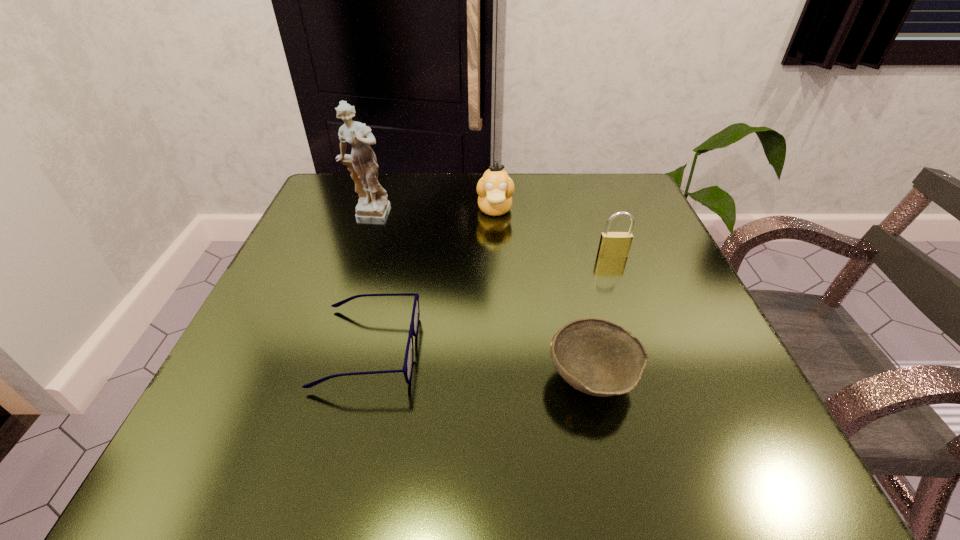
In order to click on free space between the third shortest object and the spectacles in this screenshot , I will do `click(491, 301)`.

What are the coordinates of `free area in between the fourth tallest object and the spectacles` in the screenshot? It's located at (480, 363).

In order to click on blank region between the figurine and the spectacles in this screenshot , I will do `click(368, 283)`.

Image resolution: width=960 pixels, height=540 pixels. I want to click on free point between the third tallest object and the third object from left to right, so click(554, 233).

Where is `empty space between the duckling and the third shortest object`? The height and width of the screenshot is (540, 960). empty space between the duckling and the third shortest object is located at coordinates (554, 233).

You are a GUI agent. You are given a task and a screenshot of the screen. Output one action in this format:
    pyautogui.click(x=<x>, y=<y>)
    Task: Click on the object that is the third closest to the third tallest object
    
    Given the screenshot: What is the action you would take?
    pyautogui.click(x=407, y=369)

Find the location of a particular element. object that is the fourth closest to the fourth tallest object is located at coordinates (373, 208).

Where is `vacant space that satisfies the following two spatial constraints: 1. on the face of the duckling; 2. on the front-facing side of the spectacles`? vacant space that satisfies the following two spatial constraints: 1. on the face of the duckling; 2. on the front-facing side of the spectacles is located at coordinates (501, 348).

The height and width of the screenshot is (540, 960). I want to click on free space that satisfies the following two spatial constraints: 1. on the front-facing side of the third nearest object; 2. on the front-facing side of the shortest object, so click(646, 348).